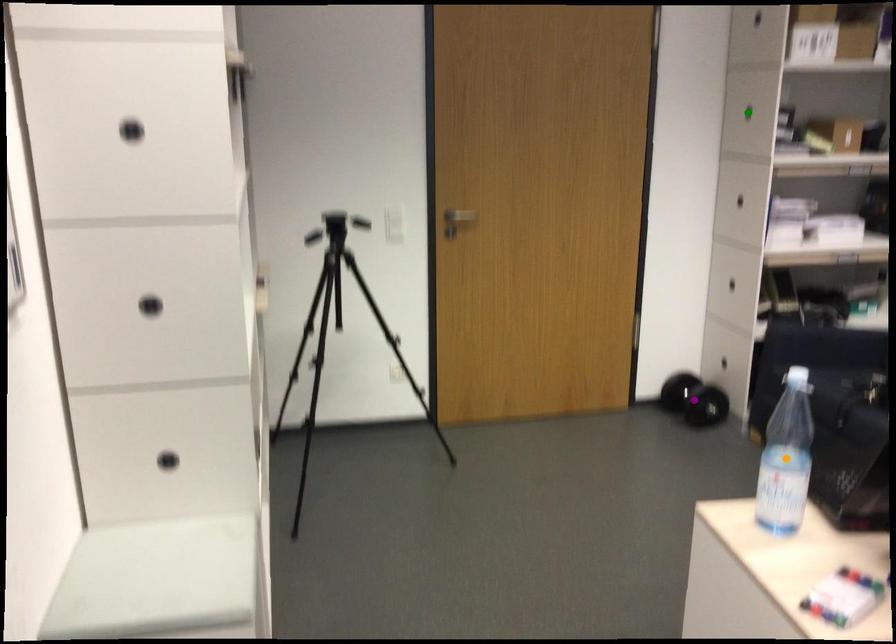
Looking at this image, order these from nearest to farthest:
A) purple point
B) orange point
C) green point

1. purple point
2. green point
3. orange point